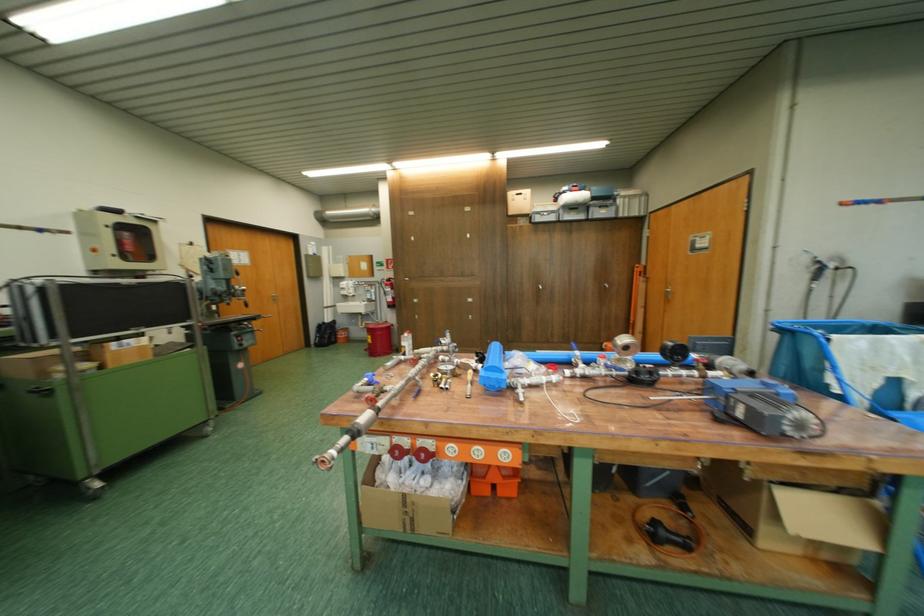
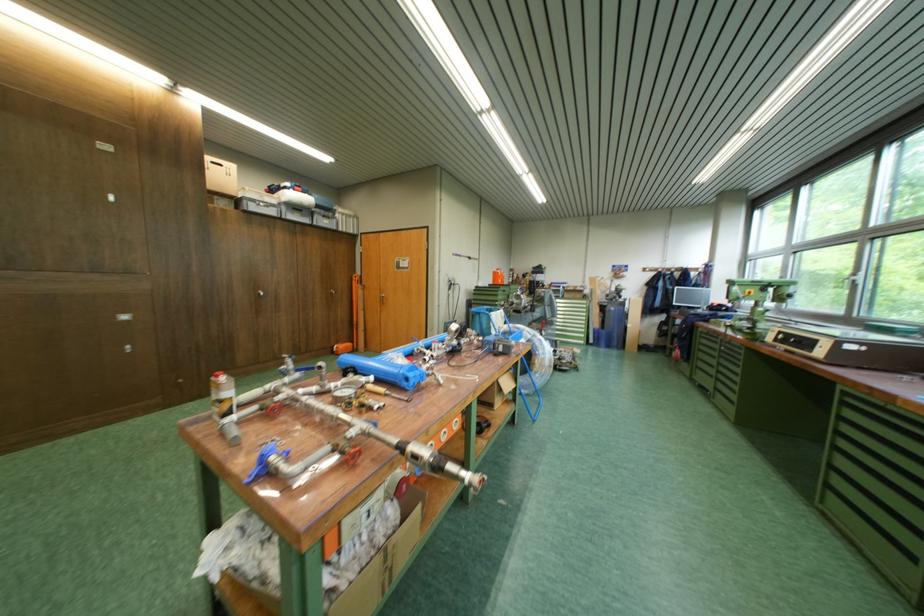
Where in the second image is the point corresponding to (652,288) from the first image?

(371, 294)